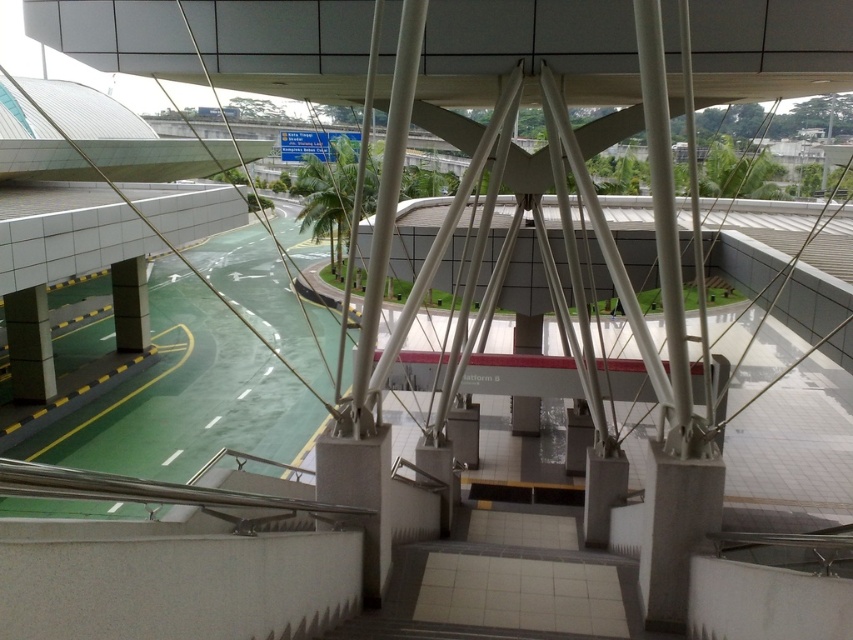
Which is behind, point (297, 182) or point (136, 349)?

Positioned behind is point (297, 182).

Is green leafy palm tree at center further to camera compared to matte gray pillar at center?

No, it is not.

Locate an element on the screen. green leafy palm tree at center is located at coordinates (329, 193).

Is point (54, 392) farther from viewer compared to point (119, 308)?

No.

This screenshot has height=640, width=853. I want to click on matte gray pillar at lower left, so click(x=28, y=346).

The height and width of the screenshot is (640, 853). What do you see at coordinates (28, 346) in the screenshot? I see `matte gray pillar at lower left` at bounding box center [28, 346].

Locate an element on the screen. Image resolution: width=853 pixels, height=640 pixels. matte gray pillar at lower left is located at coordinates (28, 346).

Is point (321, 186) positioned behind point (12, 310)?

Yes.

Between green leafy palm tree at center and matte gray pillar at lower left, which one appears on the left side from the viewer's perspective?

matte gray pillar at lower left is more to the left.

Image resolution: width=853 pixels, height=640 pixels. Identify the location of green leafy palm tree at center. (329, 193).

Where is `green leafy palm tree at center`? This screenshot has height=640, width=853. green leafy palm tree at center is located at coordinates click(x=329, y=193).